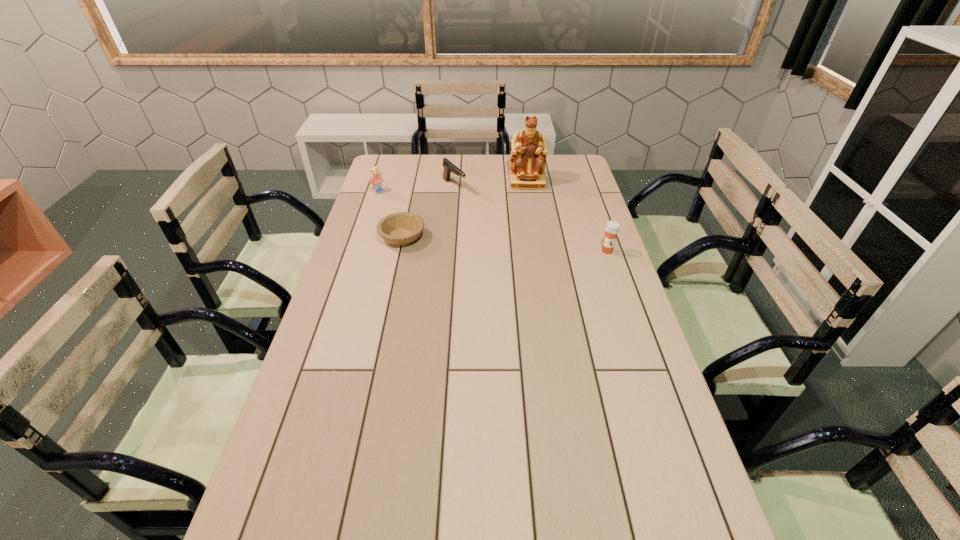
Identify the location of free space on the desktop that is between the shortest object and the medicine and is positioned at the muzzle of the pistol. (522, 245).

In order to click on vacant spot on the desktop that is between the second object from left to right and the medicine and is positioned on the front-facing side of the Lego in this screenshot , I will do `click(484, 242)`.

This screenshot has height=540, width=960. I want to click on vacant spot on the desktop that is between the bowl and the rightmost object and is positioned on the front-facing side of the figurine, so tap(531, 246).